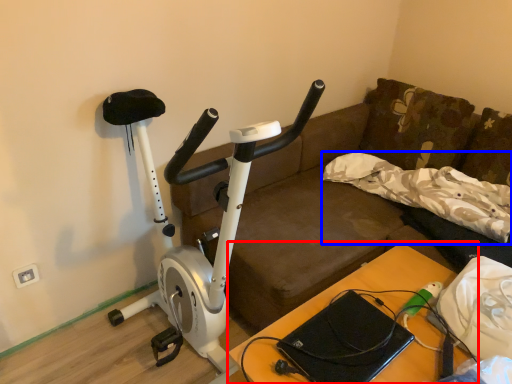
Question: Which object appears closest to the camera in this image, table (highlighted by a red box) or pillow (highlighted by a blue box)?

Choices:
 (A) table
 (B) pillow

Answer: (A)